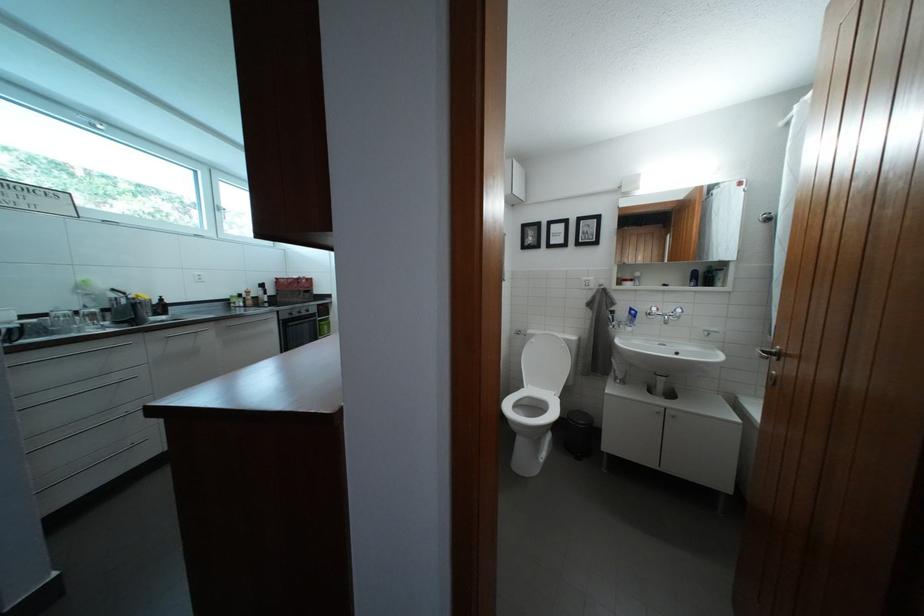
Locate an element on the screen. The image size is (924, 616). white toilet lid is located at coordinates (544, 365).